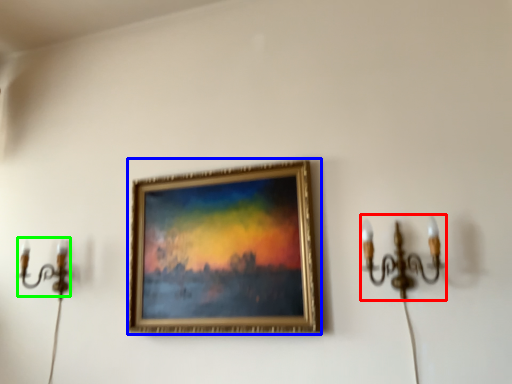
Question: Based on their relative distances, which object is farther from candle holder (highlighted by a red box)? Choose from picture frame (highlighted by a blue box) and candle holder (highlighted by a green box).

Choices:
 (A) picture frame
 (B) candle holder

Answer: (B)